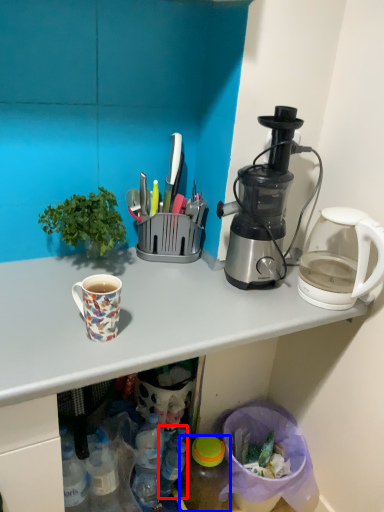
Question: Among these objects, which one is farthest to the camera, bottle (highlighted by a red box) or bottle (highlighted by a blue box)?

Choices:
 (A) bottle
 (B) bottle

Answer: (A)